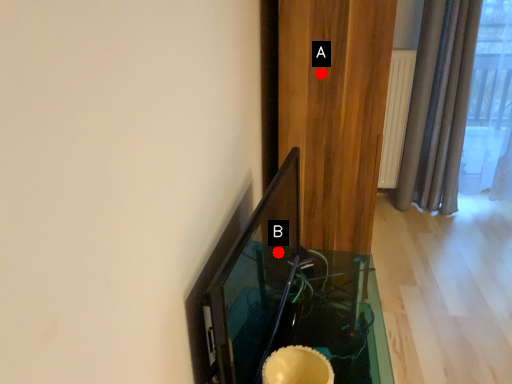
Question: Two points are circled on the image, labeled by A and B beside each circle. Which of the following is the farthest from the observer?

Choices:
 (A) A is further
 (B) B is further

Answer: (A)